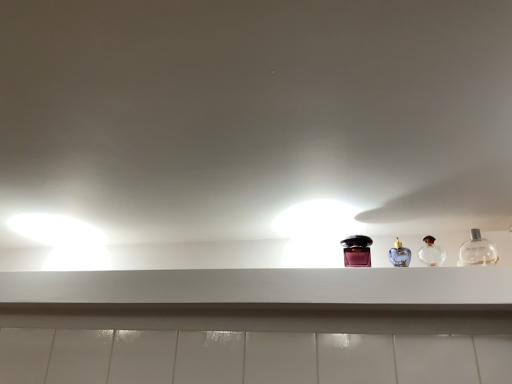
Question: Does white matte shelf at center have a greater width compared to shiny purple bottle at center, positioned as the 1th bottle in left-to-right order?

Choices:
 (A) yes
 (B) no

Answer: (A)

Question: Considering the relative sizes of white matte shelf at center and shiny purple bottle at center, positioned as the 1th bottle in left-to-right order, in the image provided, is white matte shelf at center shorter than shiny purple bottle at center, positioned as the 1th bottle in left-to-right order,?

Choices:
 (A) yes
 (B) no

Answer: (A)

Question: Is white matte shelf at center bigger than shiny purple bottle at center, positioned as the third bottle in right-to-left order?

Choices:
 (A) no
 (B) yes

Answer: (B)

Question: From the image's perspective, is white matte shelf at center below shiny purple bottle at center, positioned as the third bottle in right-to-left order?

Choices:
 (A) yes
 (B) no

Answer: (A)

Question: Are white matte shelf at center and shiny purple bottle at center, positioned as the 1th bottle in left-to-right order, far apart?

Choices:
 (A) yes
 (B) no

Answer: (B)

Question: Is white matte shelf at center smaller than shiny purple bottle at center, positioned as the 1th bottle in left-to-right order?

Choices:
 (A) yes
 (B) no

Answer: (B)

Question: Is the depth of shiny purple bottle at center, positioned as the third bottle in right-to-left order, less than that of clear glass bottle at right, the 3th bottle viewed from the left?

Choices:
 (A) yes
 (B) no

Answer: (B)

Question: Would you say clear glass bottle at right, the 3th bottle viewed from the left, is part of shiny purple bottle at center, positioned as the third bottle in right-to-left order,'s contents?

Choices:
 (A) yes
 (B) no

Answer: (B)

Question: Is shiny purple bottle at center, positioned as the 1th bottle in left-to-right order, at the left side of clear glass bottle at right, which is the 1th bottle in right-to-left order?

Choices:
 (A) yes
 (B) no

Answer: (A)

Question: Can you confirm if shiny purple bottle at center, positioned as the 1th bottle in left-to-right order, is wider than clear glass bottle at right, the 3th bottle viewed from the left?

Choices:
 (A) yes
 (B) no

Answer: (A)

Question: From a real-world perspective, is shiny purple bottle at center, positioned as the third bottle in right-to-left order, on top of clear glass bottle at right, which is the 1th bottle in right-to-left order?

Choices:
 (A) no
 (B) yes

Answer: (B)

Question: From the image's perspective, is shiny purple bottle at center, positioned as the third bottle in right-to-left order, above clear glass bottle at right, the 3th bottle viewed from the left?

Choices:
 (A) yes
 (B) no

Answer: (B)

Question: Is clear glass perfume at center right, the second bottle viewed from the right, facing towards white matte shelf at center?

Choices:
 (A) no
 (B) yes

Answer: (A)